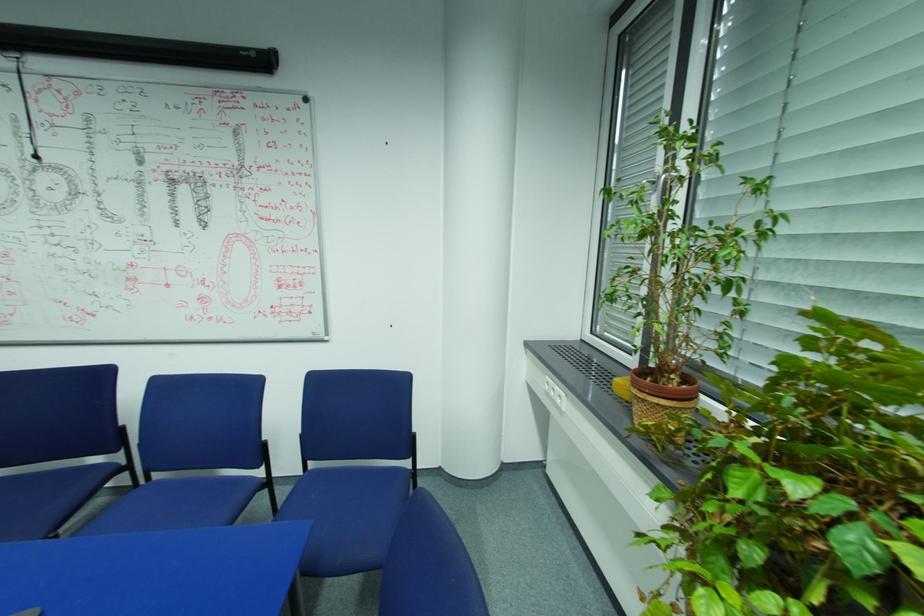
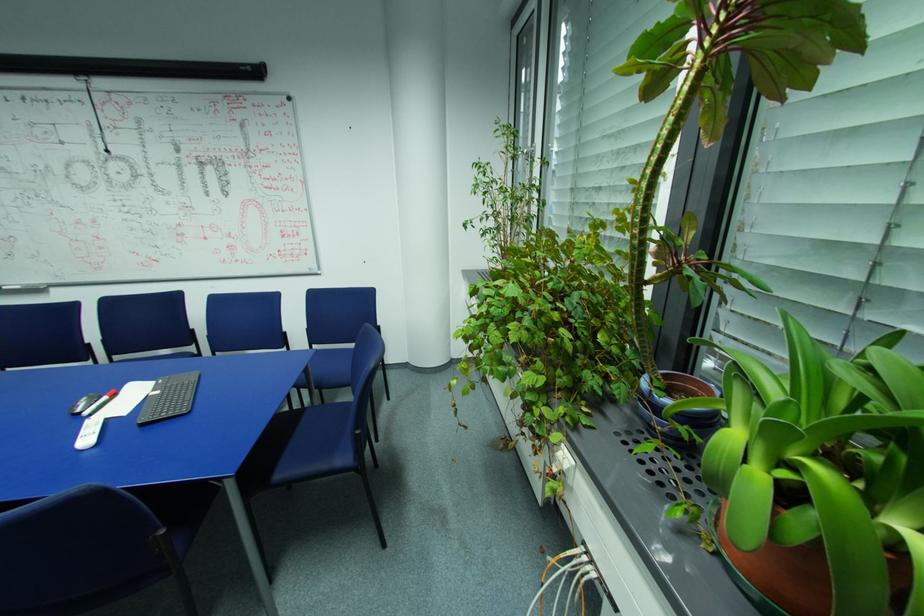
Question: The images are taken continuously from a first-person perspective. In which direction is your viewpoint rotating?

Choices:
 (A) Left
 (B) Right
 (C) Up
 (D) Down

Answer: (D)